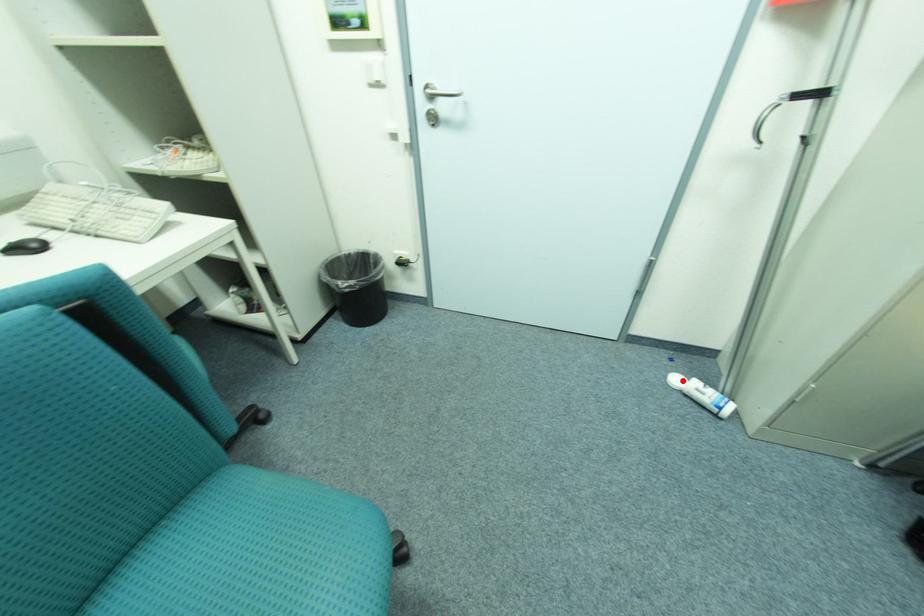
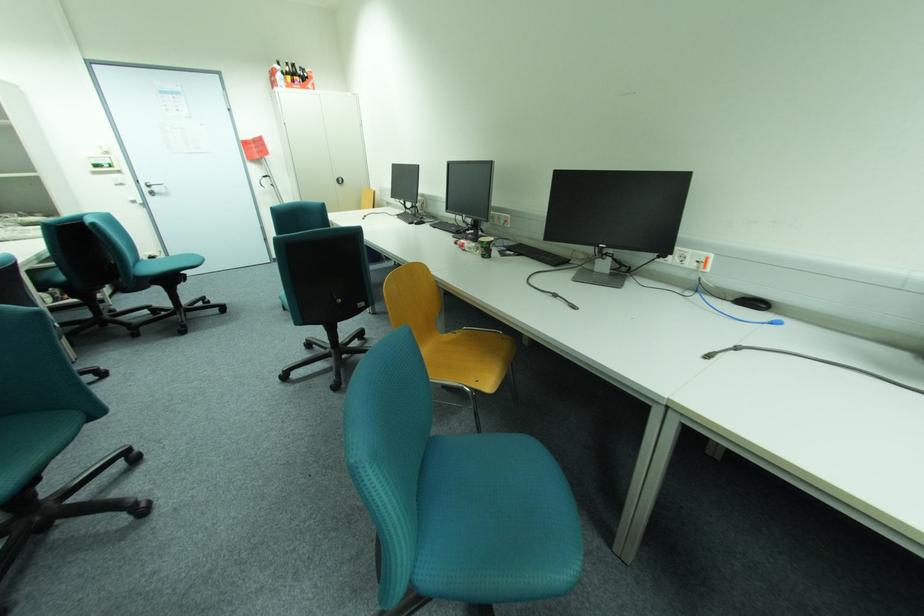
Question: I am providing you with two images of the same scene from different viewpoints. A red point is marked on the first image. At the location where the point appears in image 1, is it still visible in image 2?

Choices:
 (A) Yes
 (B) No

Answer: (B)